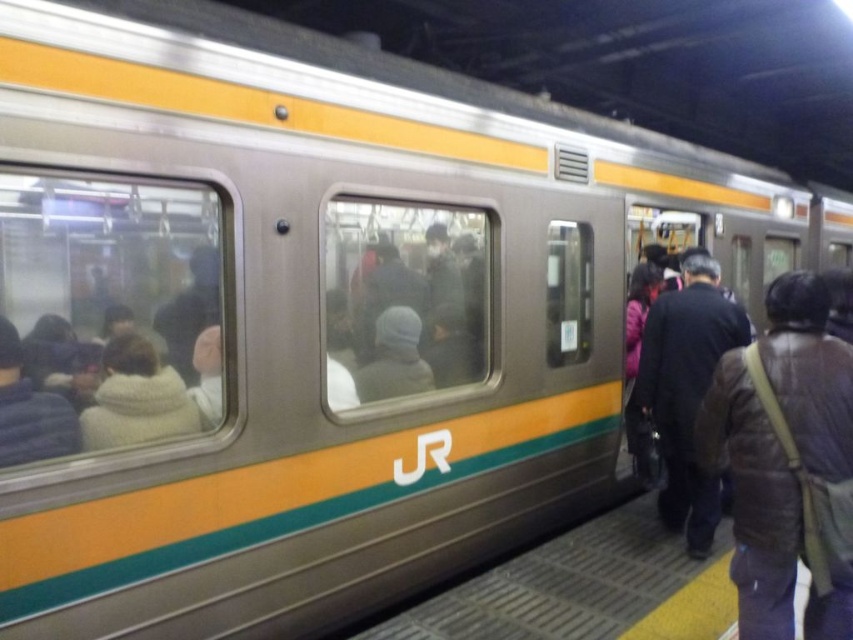
Question: Does brown leather jacket at lower right come behind dark brown leather jacket at right?

Choices:
 (A) yes
 (B) no

Answer: (B)

Question: Among these points, which one is farthest from the camera?

Choices:
 (A) (676, 308)
 (B) (749, 632)

Answer: (A)

Question: Among these objects, which one is nearest to the camera?

Choices:
 (A) dark brown leather jacket at right
 (B) brown leather jacket at lower right

Answer: (B)

Question: Considering the relative positions of brown leather jacket at lower right and dark brown leather jacket at right in the image provided, where is brown leather jacket at lower right located with respect to dark brown leather jacket at right?

Choices:
 (A) left
 (B) right

Answer: (A)

Question: Can you confirm if brown leather jacket at lower right is positioned above dark brown leather jacket at right?

Choices:
 (A) yes
 (B) no

Answer: (B)